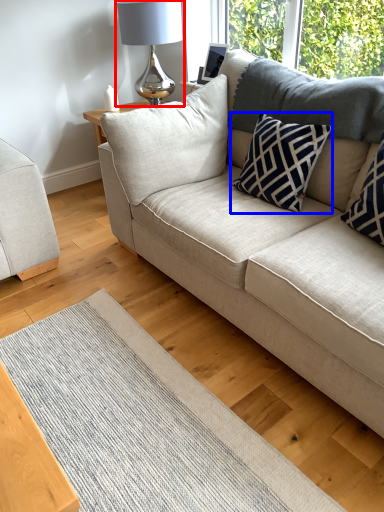
Question: Which object is further to the camera taking this photo, table lamp (highlighted by a red box) or pillow (highlighted by a blue box)?

Choices:
 (A) table lamp
 (B) pillow

Answer: (A)